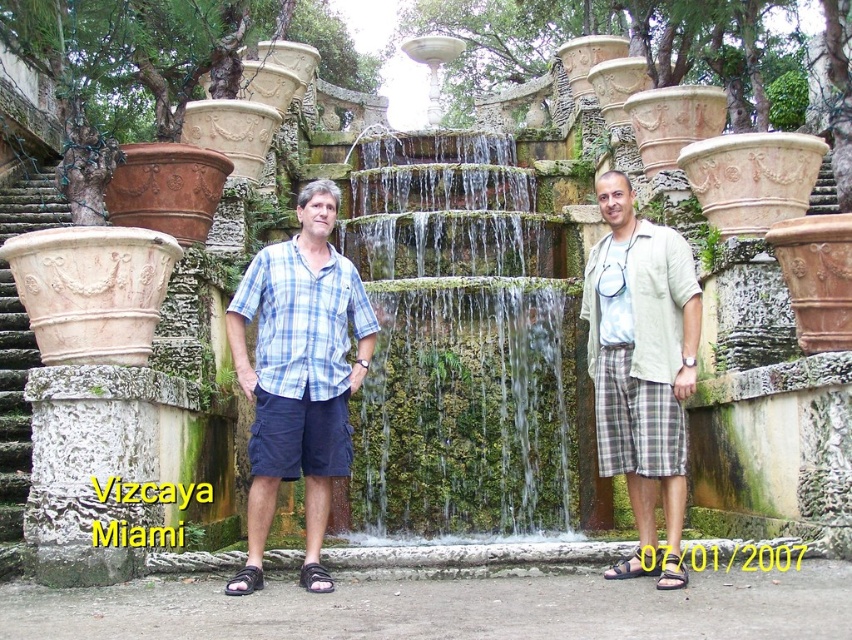
Question: Which object is the closest to the light beige cotton shirt at center?

Choices:
 (A) blue plaid shirt at center
 (B) green mossy stone waterfall at center

Answer: (A)

Question: Does green mossy stone waterfall at center appear over blue plaid shirt at center?

Choices:
 (A) no
 (B) yes

Answer: (B)

Question: Does green mossy stone waterfall at center have a smaller size compared to blue plaid shirt at center?

Choices:
 (A) no
 (B) yes

Answer: (A)

Question: Among these objects, which one is nearest to the camera?

Choices:
 (A) green mossy stone waterfall at center
 (B) blue plaid shirt at center

Answer: (B)

Question: Which object is positioned farthest from the green mossy stone waterfall at center?

Choices:
 (A) blue plaid shirt at center
 (B) light beige cotton shirt at center

Answer: (B)

Question: Is green mossy stone waterfall at center to the left of light beige cotton shirt at center from the viewer's perspective?

Choices:
 (A) yes
 (B) no

Answer: (A)